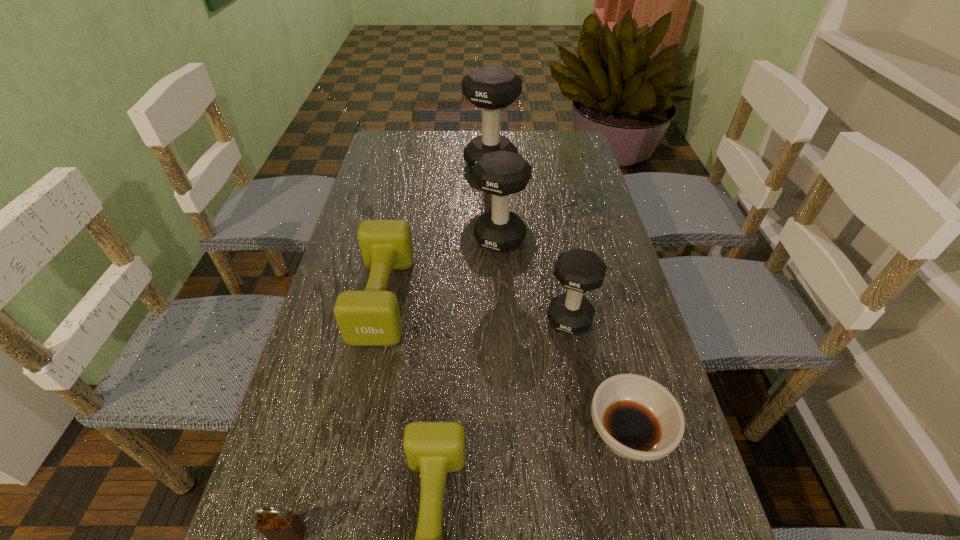
What are the coordinates of `free space at the right edge` in the screenshot? It's located at (631, 319).

Locate an element on the screen. free point at the far left corner is located at coordinates (413, 154).

In the image, there is a desktop. Where is `free space at the far right corner`? free space at the far right corner is located at coordinates (563, 142).

Locate an element on the screen. free space between the soup bowl and the fourth nearest dumbbell is located at coordinates (x=563, y=338).

This screenshot has width=960, height=540. I want to click on vacant area between the third shortest dumbbell and the farthest gray dumbbell, so point(530,241).

Where is `object that is the second closest to the bigger olive dumbbell`? This screenshot has height=540, width=960. object that is the second closest to the bigger olive dumbbell is located at coordinates (432, 448).

Identify which object is located as the fourth nearest to the tallest dumbbell. Please provide its 2D coordinates. Your answer should be formatted as a tuple, i.e. [(x, y)], where the tuple contains the x and y coordinates of a point satisfying the conditions above.

[(637, 418)]

Locate which dumbbell ranks in proximity to the right olive dumbbell. Please provide its 2D coordinates. Your answer should be formatted as a tuple, i.e. [(x, y)], where the tuple contains the x and y coordinates of a point satisfying the conditions above.

[(371, 317)]

In order to click on the closest dumbbell to the third shortest dumbbell in this screenshot , I will do `click(501, 173)`.

What are the coordinates of `gray dumbbell that stands as the third closest to the soup bowl` in the screenshot? It's located at (491, 88).